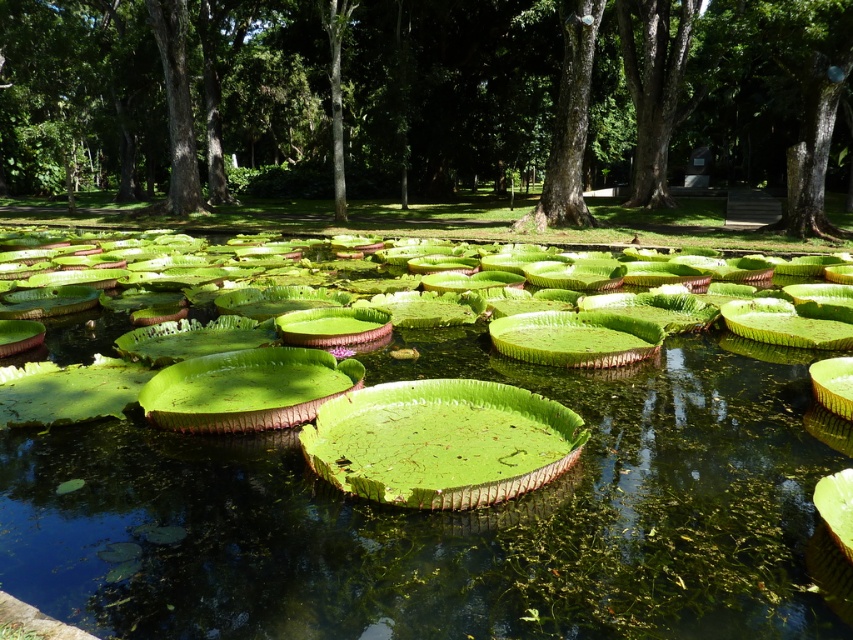
Is green leafy water at center behind smooth bark tree at center?

No, green leafy water at center is in front of smooth bark tree at center.

Is point (498, 600) positioned in front of point (563, 81)?

Yes, point (498, 600) is closer to viewer.

This screenshot has width=853, height=640. I want to click on green leafy water at center, so click(x=450, y=516).

Identify the location of green leafy water at center. (450, 516).

Does green leafy tree at center have a lesser height compared to smooth bark tree at center?

In fact, green leafy tree at center may be taller than smooth bark tree at center.

Locate an element on the screen. green leafy tree at center is located at coordinates (424, 99).

Does green leafy water at center have a lesser height compared to green leafy tree at center?

Yes.

Which is more to the left, green leafy water at center or green leafy tree at center?

From the viewer's perspective, green leafy tree at center appears more on the left side.

Locate an element on the screen. green leafy water at center is located at coordinates [x=450, y=516].